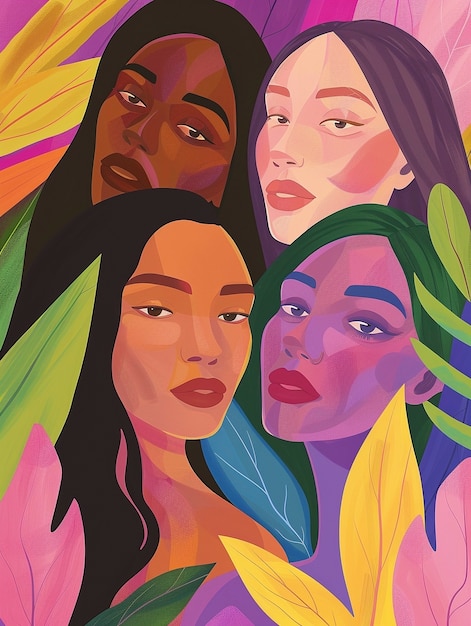
You are a GUI agent. You are given a task and a screenshot of the screen. Output one action in this format:
    pyautogui.click(x=<x>, y=<y>)
    Task: Click on the female - painting/art
    This screenshot has height=626, width=471.
    Given the screenshot: What is the action you would take?
    [x=165, y=357], [x=350, y=360], [x=179, y=118]